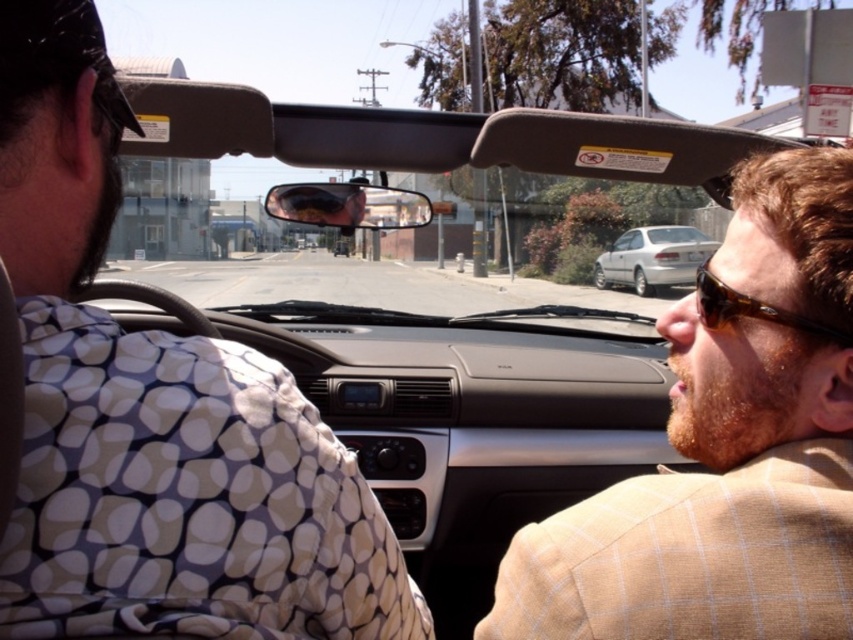
You are a passenger in the convertible car and want to point out two specific points in the scene. The first point is at coordinates point(670, 556) and the second is at point(683, 257). Which of these two points is nearer to you?

Point(670, 556) is closer to the camera than point(683, 257), so the first point is nearer to you.

You are a fashion designer observing the beige textured blazer at left and the brown tortoiseshell sunglasses at right in the convertible car. Which item of clothing or accessory is bigger in size?

The beige textured blazer at left is larger in size compared to the brown tortoiseshell sunglasses at right.

You are sitting in the back seat of the convertible car and want to hand a document to the passenger wearing the brown tortoiseshell sunglasses at right. To reach them, you need to pass the beige textured blazer at left. Which direction should you move first to avoid bumping into the blazer?

Since the beige textured blazer at left is to the left of the brown tortoiseshell sunglasses at right, you should move to the right first to avoid bumping into the beige textured blazer at left while reaching the passenger.